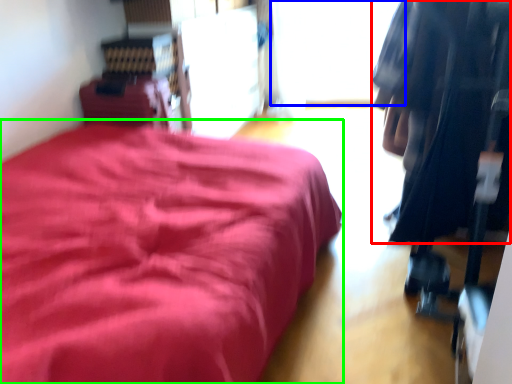
Question: Estimate the real-world distances between objects in this image. Which object is closer to clothing (highlighted by a red box), window (highlighted by a blue box) or furniture (highlighted by a green box)?

Choices:
 (A) window
 (B) furniture

Answer: (B)